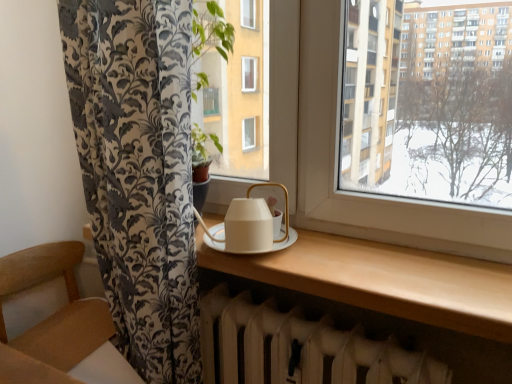
What do you see at coordinates (59, 326) in the screenshot? The image size is (512, 384). I see `wooden armchair at lower left` at bounding box center [59, 326].

The width and height of the screenshot is (512, 384). What do you see at coordinates (249, 226) in the screenshot?
I see `white matte tea set at center` at bounding box center [249, 226].

What do you see at coordinates (385, 280) in the screenshot? I see `matte white table at center` at bounding box center [385, 280].

In order to click on wooden armchair at lower left in this screenshot , I will do `click(59, 326)`.

From a real-world perspective, is wooden armchair at lower left above or below matte white table at center?

From a real-world perspective, wooden armchair at lower left is physically below matte white table at center.

How many degrees apart are the facing directions of wooden armchair at lower left and matte white table at center?

The angular difference between wooden armchair at lower left and matte white table at center is 83.6 degrees.

Could you tell me if wooden armchair at lower left is facing matte white table at center?

No, wooden armchair at lower left is not oriented towards matte white table at center.

Who is more distant, wooden armchair at lower left or matte white table at center?

wooden armchair at lower left is more distant.

The height and width of the screenshot is (384, 512). Identify the location of armchair located behind the matte white table at center. (59, 326).

Is matte white table at center wider or thinner than wooden armchair at lower left?

In the image, matte white table at center appears to be more narrow than wooden armchair at lower left.

From a real-world perspective, does matte white table at center sit lower than wooden armchair at lower left?

No.

From the image's perspective, does matte white table at center appear higher than wooden armchair at lower left?

Indeed, from the image's perspective, matte white table at center is shown above wooden armchair at lower left.

Between wooden armchair at lower left and white matte tea set at center, which one is positioned behind?

white matte tea set at center.

Does point (42, 327) come in front of point (267, 234)?

No.

Is wooden armchair at lower left far away from white matte tea set at center?

wooden armchair at lower left is actually quite close to white matte tea set at center.

Does white matte radiator at lower center come in front of wooden armchair at lower left?

No, white matte radiator at lower center is behind wooden armchair at lower left.

From a real-world perspective, is white matte radiator at lower center on top of wooden armchair at lower left?

Indeed, from a real-world perspective, white matte radiator at lower center stands above wooden armchair at lower left.

Is there a large distance between white matte radiator at lower center and wooden armchair at lower left?

Actually, white matte radiator at lower center and wooden armchair at lower left are a little close together.

Is matte white table at center positioned beyond the bounds of white matte radiator at lower center?

Yes, matte white table at center is located beyond the bounds of white matte radiator at lower center.

How many degrees apart are the facing directions of matte white table at center and white matte radiator at lower center?

They differ by 0.366 degrees in their facing directions.

Is point (350, 247) behind point (224, 383)?

No, it is not.

Are white matte radiator at lower center and white matte tea set at center far apart?

white matte radiator at lower center is near white matte tea set at center, not far away.

Is white matte radiator at lower center oriented away from white matte tea set at center?

No, white matte radiator at lower center is not facing the opposite direction of white matte tea set at center.

Between white matte radiator at lower center and white matte tea set at center, which one has smaller size?

With smaller size is white matte tea set at center.

Considering the sizes of wooden armchair at lower left and white matte radiator at lower center in the image, is wooden armchair at lower left wider or thinner than white matte radiator at lower center?

wooden armchair at lower left is wider than white matte radiator at lower center.

Which object is further away from the camera taking this photo, wooden armchair at lower left or white matte radiator at lower center?

Positioned behind is white matte radiator at lower center.

Considering the relative sizes of wooden armchair at lower left and white matte radiator at lower center in the image provided, is wooden armchair at lower left bigger than white matte radiator at lower center?

Indeed, wooden armchair at lower left has a larger size compared to white matte radiator at lower center.

Identify the location of table positioned vertically above the wooden armchair at lower left (from a real-world perspective). Image resolution: width=512 pixels, height=384 pixels. (385, 280).

In the image, there is a matte white table at center. At what (x,y) coordinates should I click in order to perform the action: click on armchair below it (from a real-world perspective). Please return your answer as a coordinate pair (x, y). The image size is (512, 384). Looking at the image, I should click on (59, 326).

Considering their positions, is white matte radiator at lower center positioned further to white matte tea set at center than wooden armchair at lower left?

wooden armchair at lower left is further to white matte tea set at center.

Based on their spatial positions, is white matte tea set at center or matte white table at center closer to white matte radiator at lower center?

Among the two, matte white table at center is located nearer to white matte radiator at lower center.

Estimate the real-world distances between objects in this image. Which object is closer to wooden armchair at lower left, white matte radiator at lower center or matte white table at center?

white matte radiator at lower center.

When comparing their distances from white matte radiator at lower center, does wooden armchair at lower left or matte white table at center seem closer?

matte white table at center lies closer to white matte radiator at lower center than the other object.

From the image, which object appears to be farther from white matte tea set at center, wooden armchair at lower left or white matte radiator at lower center?

wooden armchair at lower left lies further to white matte tea set at center than the other object.

Looking at the image, which one is located closer to wooden armchair at lower left, white matte tea set at center or matte white table at center?

The object closer to wooden armchair at lower left is white matte tea set at center.

From the image, which object appears to be nearer to wooden armchair at lower left, white matte tea set at center or white matte radiator at lower center?

white matte radiator at lower center is positioned closer to the anchor wooden armchair at lower left.

From the image, which object appears to be nearer to matte white table at center, white matte radiator at lower center or wooden armchair at lower left?

The object closer to matte white table at center is white matte radiator at lower center.

Locate an element on the screen. table between wooden armchair at lower left and white matte radiator at lower center from left to right is located at coordinates (385, 280).

Find the location of `tea set between wooden armchair at lower left and matte white table at center from left to right`. tea set between wooden armchair at lower left and matte white table at center from left to right is located at coordinates (249, 226).

Where is `tea set situated between wooden armchair at lower left and white matte radiator at lower center from left to right`? tea set situated between wooden armchair at lower left and white matte radiator at lower center from left to right is located at coordinates (249, 226).

You are a GUI agent. You are given a task and a screenshot of the screen. Output one action in this format:
    pyautogui.click(x=<x>, y=<y>)
    Task: Click on the table between white matte tea set at center and white matte radiator at lower center from top to bottom
    
    Given the screenshot: What is the action you would take?
    click(385, 280)